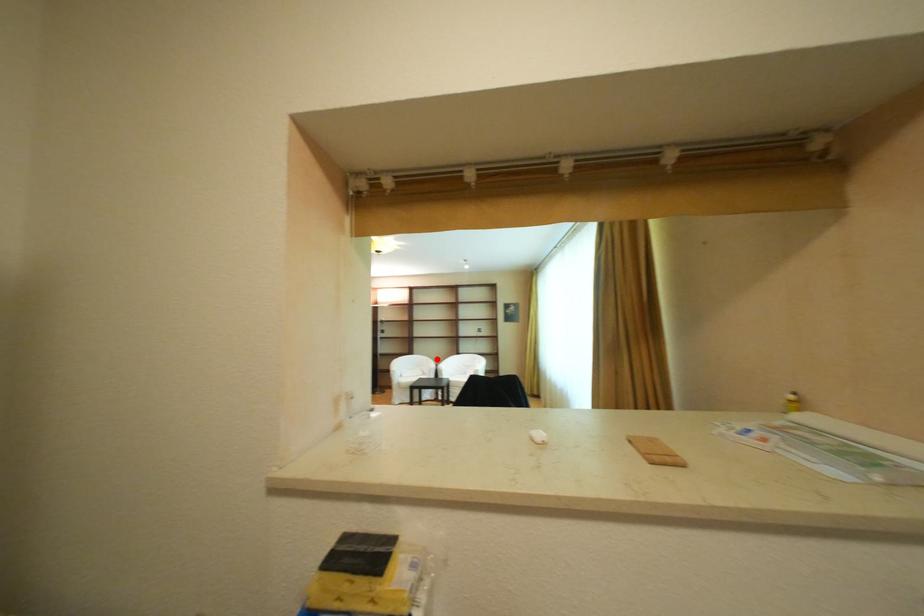
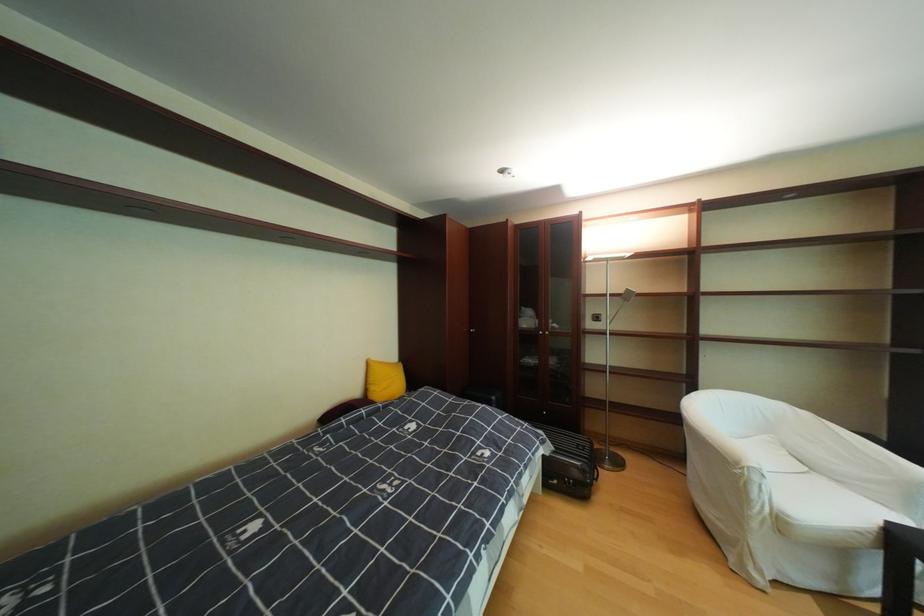
The point at the highlighted location is marked in the first image. Where is the corresponding point in the second image?

(793, 407)